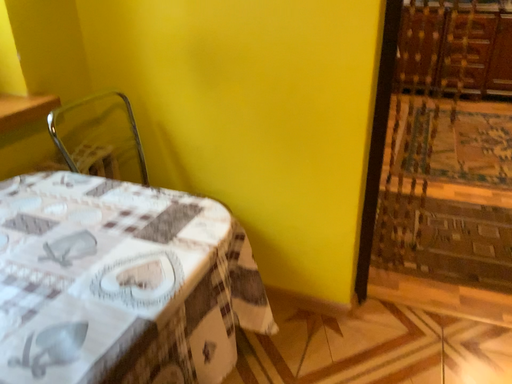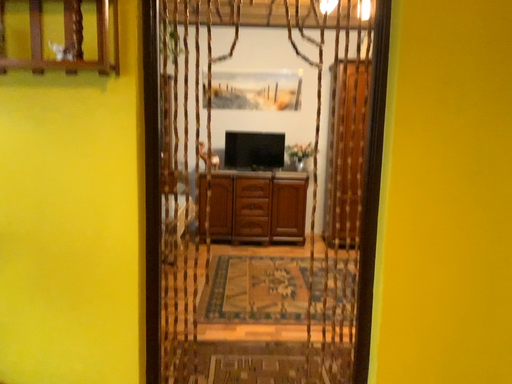
Question: Which way did the camera rotate in the video?

Choices:
 (A) rotated left
 (B) rotated right

Answer: (B)